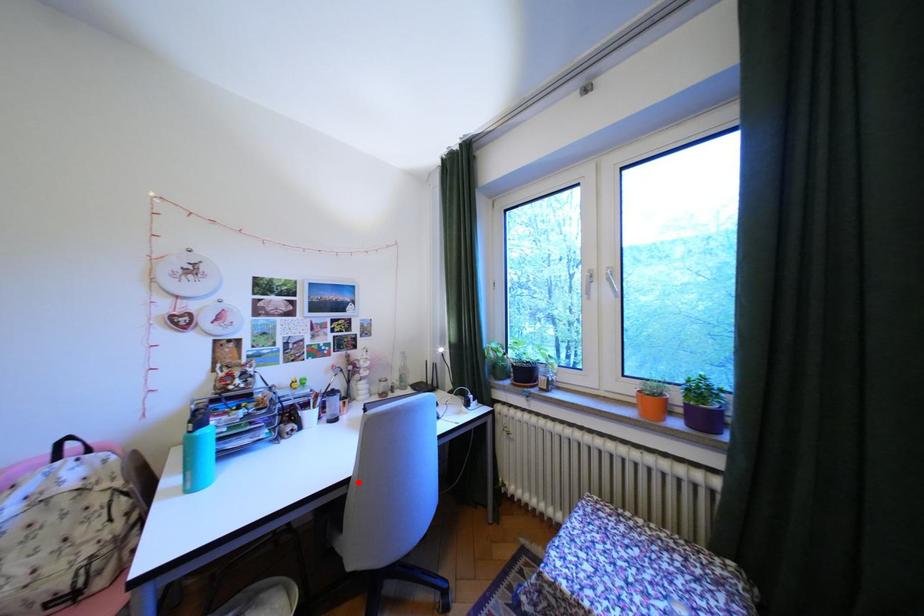
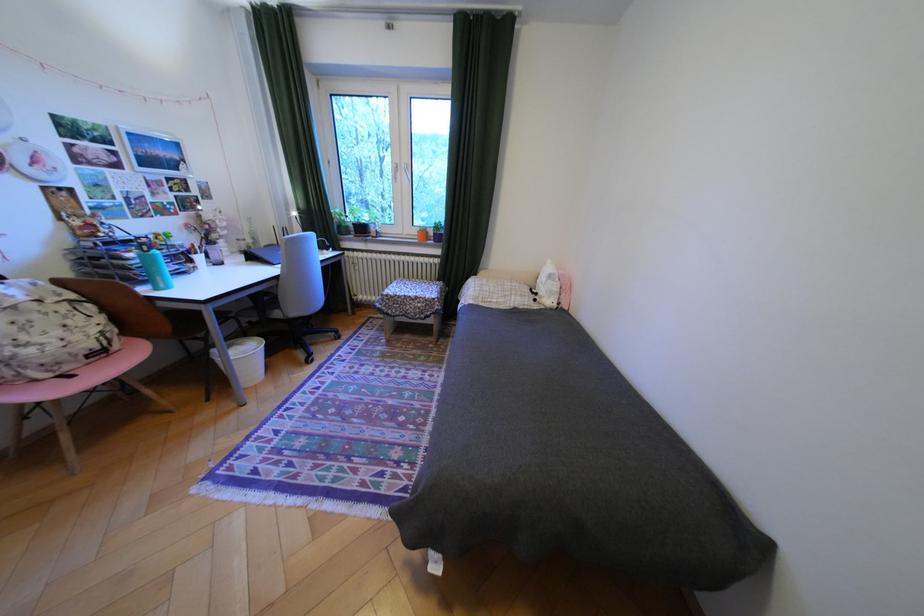
Find the pixel in the second image that matches the highlighted location in the first image.

(288, 278)